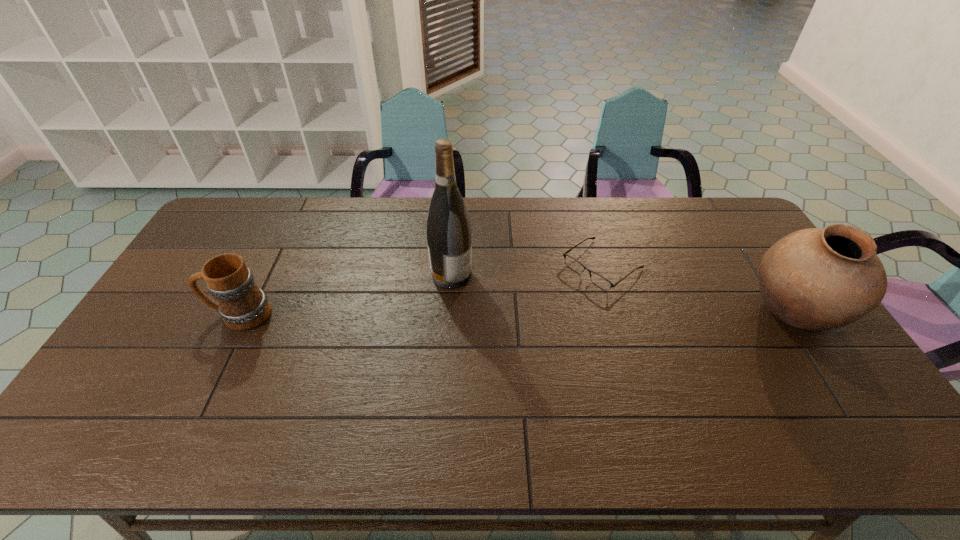
Locate an element on the screen. The image size is (960, 540). vacant space located on the side of the mug with the handle is located at coordinates (188, 315).

The image size is (960, 540). I want to click on vacant space located on the left of the third shortest object, so click(664, 313).

The width and height of the screenshot is (960, 540). In order to click on vacant position located 0.140m on the label of the wine bottle in this screenshot , I will do `click(505, 304)`.

At what (x,y) coordinates should I click in order to perform the action: click on free spot located 0.230m on the label of the wine bottle. Please return your answer as a coordinate pair (x, y). The height and width of the screenshot is (540, 960). Looking at the image, I should click on (531, 318).

Locate an element on the screen. vacant space located on the label of the wine bottle is located at coordinates (537, 321).

The height and width of the screenshot is (540, 960). In order to click on free region located on the front-facing side of the spectacles in this screenshot , I will do `click(491, 352)`.

The image size is (960, 540). Find the location of `vacant position located on the front-facing side of the spectacles`. vacant position located on the front-facing side of the spectacles is located at coordinates (526, 325).

Identify the location of vacant space situated on the front-facing side of the spectacles. (566, 293).

The height and width of the screenshot is (540, 960). In order to click on object that is at the left edge in this screenshot , I will do `click(243, 306)`.

The width and height of the screenshot is (960, 540). I want to click on object that is at the right edge, so click(x=816, y=279).